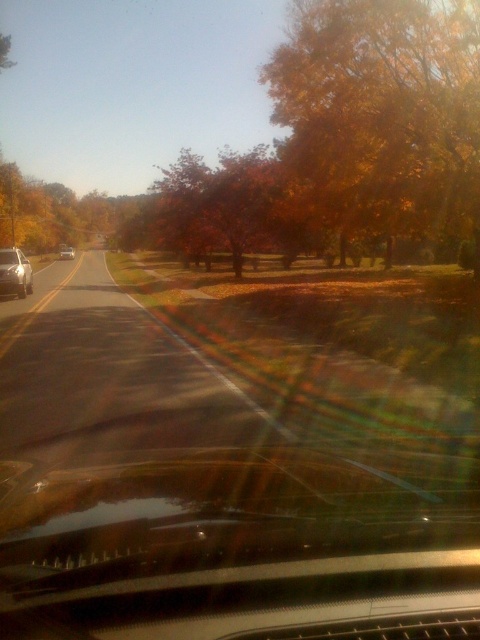
Question: Can you confirm if transparent glass car window at center is smaller than orange leafy tree at center?

Choices:
 (A) no
 (B) yes

Answer: (B)

Question: Where is transparent glass car window at center located in relation to golden leafy tree at upper right in the image?

Choices:
 (A) below
 (B) above

Answer: (A)

Question: Which of the following is the farthest from the observer?

Choices:
 (A) silver metallic sedan at left
 (B) transparent glass car window at center

Answer: (A)

Question: Which of these objects is positioned farthest from the transparent glass car window at center?

Choices:
 (A) golden leafy tree at upper right
 (B) orange leafy tree at center
 (C) matte black car at left

Answer: (C)

Question: Estimate the real-world distances between objects in this image. Which object is closer to the matte black car at left?

Choices:
 (A) silver metallic sedan at left
 (B) orange leafy tree at center

Answer: (B)

Question: Is golden leafy tree at upper right behind matte black car at left?

Choices:
 (A) yes
 (B) no

Answer: (B)